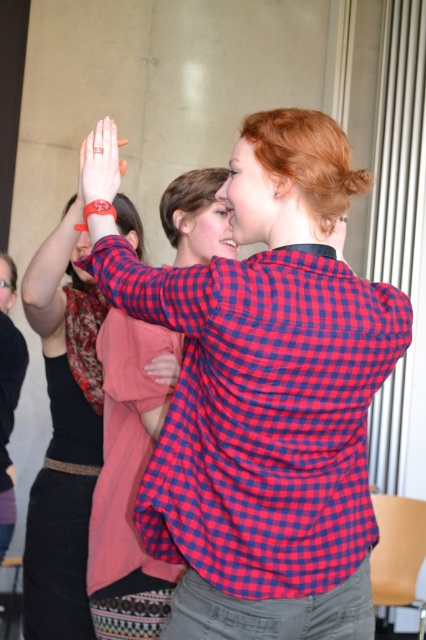
Does matte red wristband at upper left have a smaller size compared to matte pink hand at center?

Actually, matte red wristband at upper left might be larger than matte pink hand at center.

Does matte red wristband at upper left appear on the right side of matte pink hand at center?

No, matte red wristband at upper left is not to the right of matte pink hand at center.

Which is behind, point (101, 124) or point (155, 371)?

The point (155, 371) is more distant.

Where is `matte red wristband at upper left`? The height and width of the screenshot is (640, 426). matte red wristband at upper left is located at coordinates (101, 161).

Can you confirm if red checkered shirt at center is wider than matte pink hand at center?

Yes, red checkered shirt at center is wider than matte pink hand at center.

Which is more to the left, red checkered shirt at center or matte pink hand at center?

matte pink hand at center is more to the left.

Between point (337, 580) and point (175, 381), which one is positioned behind?

Positioned behind is point (175, 381).

Find the location of `red checkered shirt at center`. red checkered shirt at center is located at coordinates (265, 397).

Is black leather pants at lower left behind matte pink hand at center?

Yes.

Based on the photo, who is more distant from viewer, (20,349) or (149,371)?

Positioned behind is point (20,349).

Between point (5, 506) and point (157, 369), which one is positioned in front?

Point (157, 369) is more forward.

What are the coordinates of `black leather pants at lower left` in the screenshot? It's located at (8, 394).